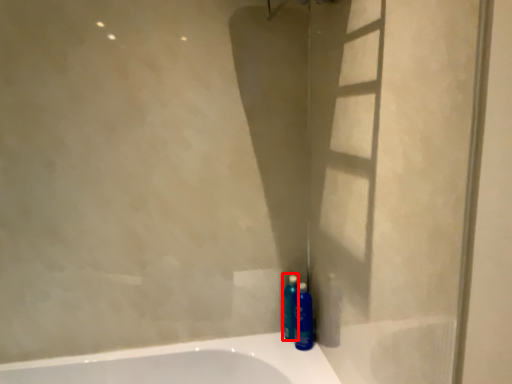
Question: From the image's perspective, what is the correct spatial positioning of cleaning product (annotated by the red box) in reference to mouthwash?

Choices:
 (A) below
 (B) above

Answer: (B)